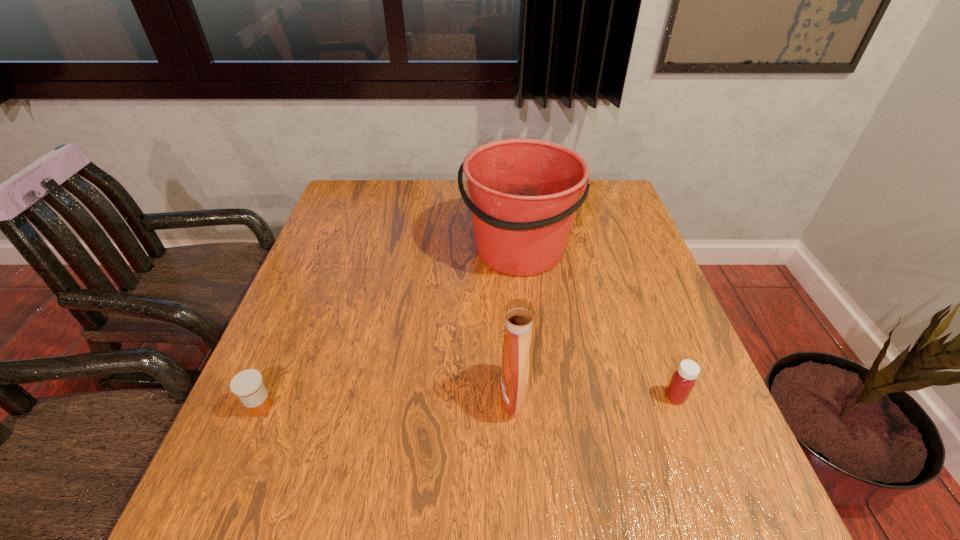
At what (x,y) coordinates should I click in order to perform the action: click on the farthest object. Please return your answer as a coordinate pair (x, y). Looking at the image, I should click on (524, 193).

Find the location of a particular element. detergent is located at coordinates (519, 316).

You are a GUI agent. You are given a task and a screenshot of the screen. Output one action in this format:
    pyautogui.click(x=<x>, y=<y>)
    Task: Click on the right medicine
    This screenshot has width=960, height=540.
    Given the screenshot: What is the action you would take?
    pyautogui.click(x=683, y=380)

Find the location of a particular element. the leftmost object is located at coordinates (247, 385).

The height and width of the screenshot is (540, 960). Find the location of `vacant region located 0.070m on the front of the bucket`. vacant region located 0.070m on the front of the bucket is located at coordinates (523, 307).

This screenshot has width=960, height=540. I want to click on free location located 0.340m on the front-facing side of the detergent, so coord(329,395).

You are a GUI agent. You are given a task and a screenshot of the screen. Output one action in this format:
    pyautogui.click(x=<x>, y=<y>)
    Task: Click on the vacant position located 0.120m on the front-facing side of the detergent
    The width and height of the screenshot is (960, 540).
    Given the screenshot: What is the action you would take?
    pyautogui.click(x=440, y=395)

Locate an element on the screen. The image size is (960, 540). free space located on the front-facing side of the detergent is located at coordinates (340, 395).

You are a GUI agent. You are given a task and a screenshot of the screen. Output one action in this format:
    pyautogui.click(x=<x>, y=<y>)
    Task: Click on the vacant space located on the front of the right medicine
    The image size is (960, 540).
    Given the screenshot: What is the action you would take?
    pyautogui.click(x=700, y=461)

Locate an element on the screen. This screenshot has height=540, width=960. free region located 0.070m on the label of the leftmost object is located at coordinates point(241,455).